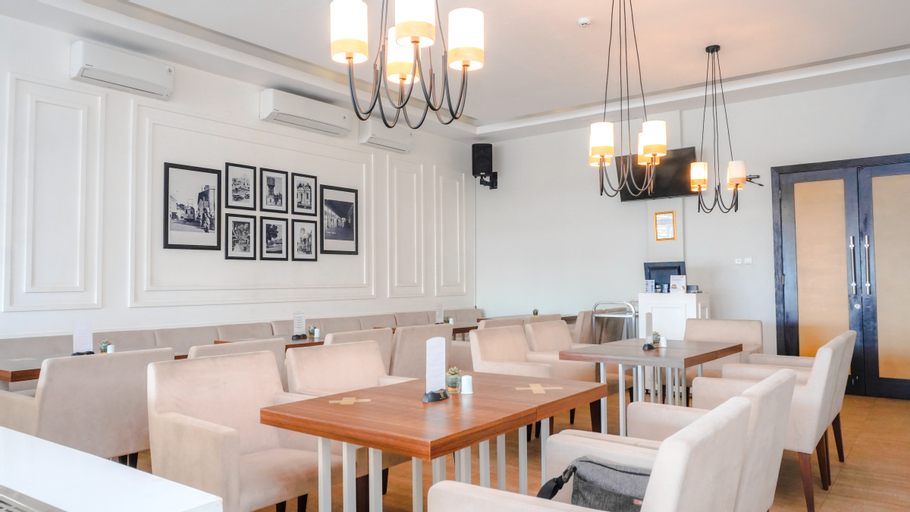
Locate an element on the screen. This screenshot has height=512, width=910. framed artwork on wall is located at coordinates (336, 219), (300, 193), (271, 185), (238, 183), (238, 234), (276, 241), (306, 245), (193, 208).